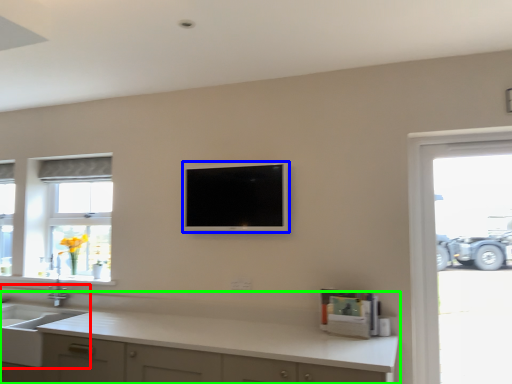
Question: Which object is positioned closest to sink (highlighted by a red box)? Select from television (highlighted by a blue box) and countertop (highlighted by a green box).

Choices:
 (A) television
 (B) countertop

Answer: (B)